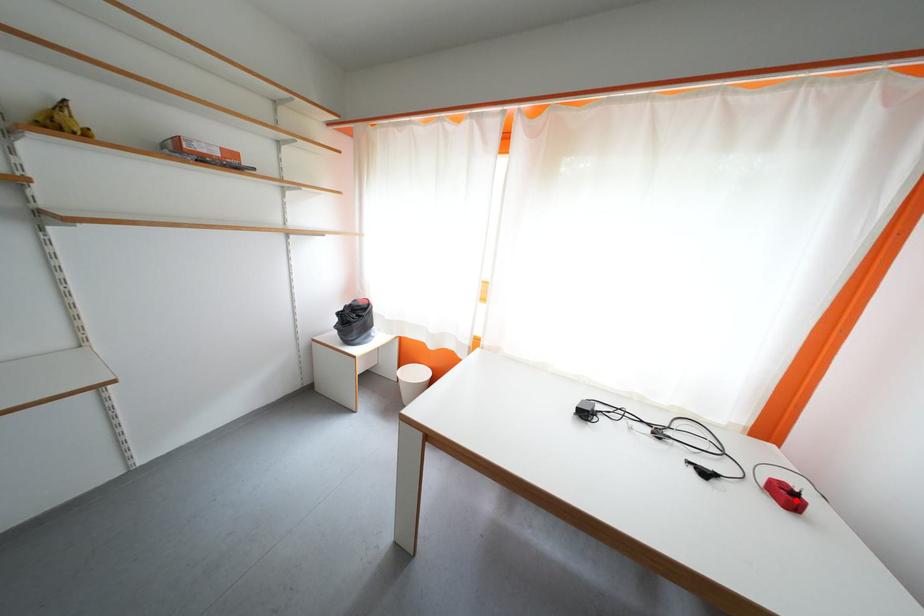
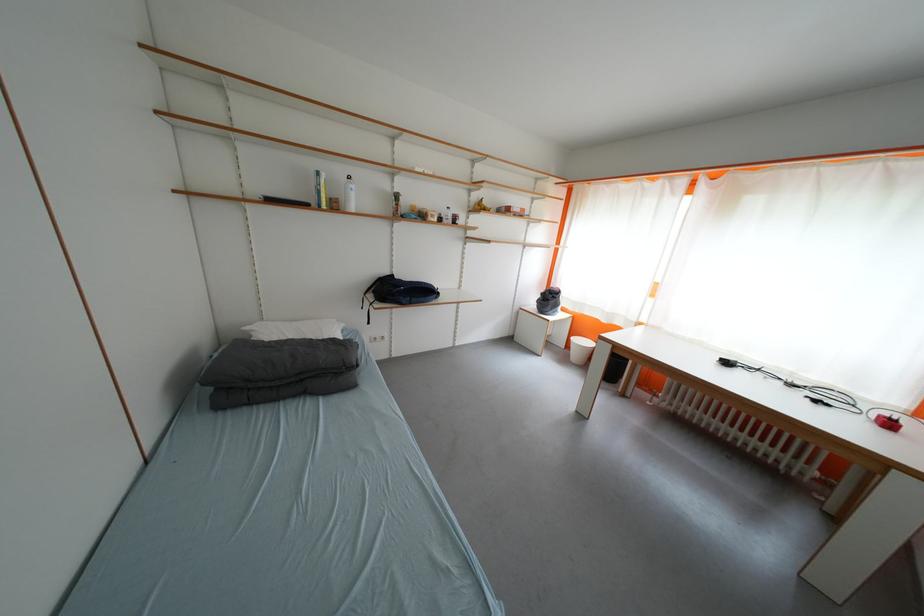
Question: A red point is marked in image1. In image2, is the corresponding 3D point closer to the camera or farther? Reply with the corresponding letter.

Choices:
 (A) The corresponding 3D point is closer.
 (B) The corresponding 3D point is farther.

Answer: (A)